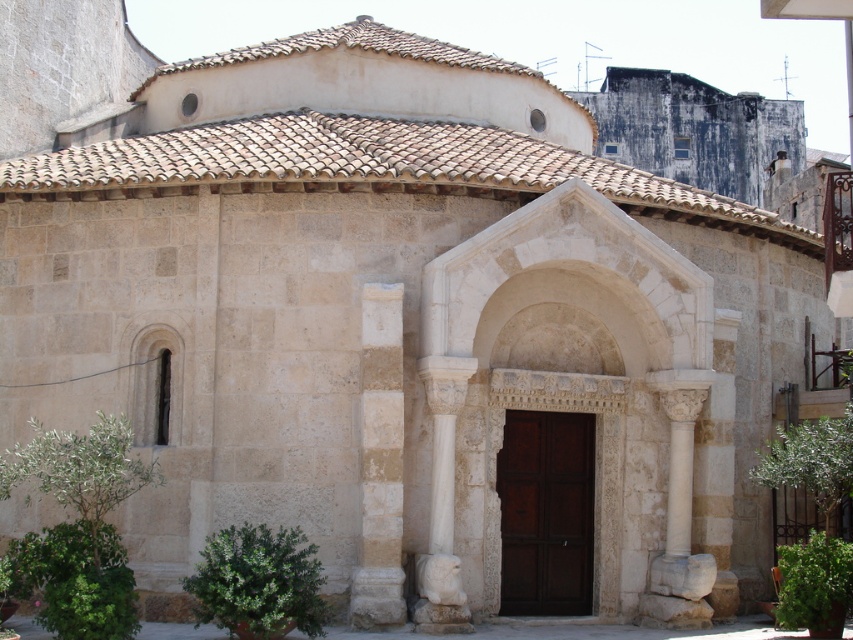
Question: Does white stone archway at center have a lesser width compared to white stone column at center?

Choices:
 (A) no
 (B) yes

Answer: (A)

Question: Which point appears farthest from the camera in this image?

Choices:
 (A) (674, 342)
 (B) (363, 595)

Answer: (A)

Question: Observing the image, what is the correct spatial positioning of white stone archway at center in reference to white stone column at center?

Choices:
 (A) below
 (B) above

Answer: (B)

Question: Does white stone archway at center have a larger size compared to white stone column at center?

Choices:
 (A) no
 (B) yes

Answer: (B)